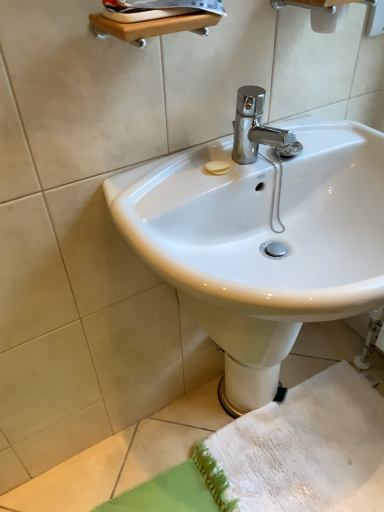
Find the location of a particular element. The height and width of the screenshot is (512, 384). vacant space situated on the left part of white textured towel at lower right is located at coordinates (154, 452).